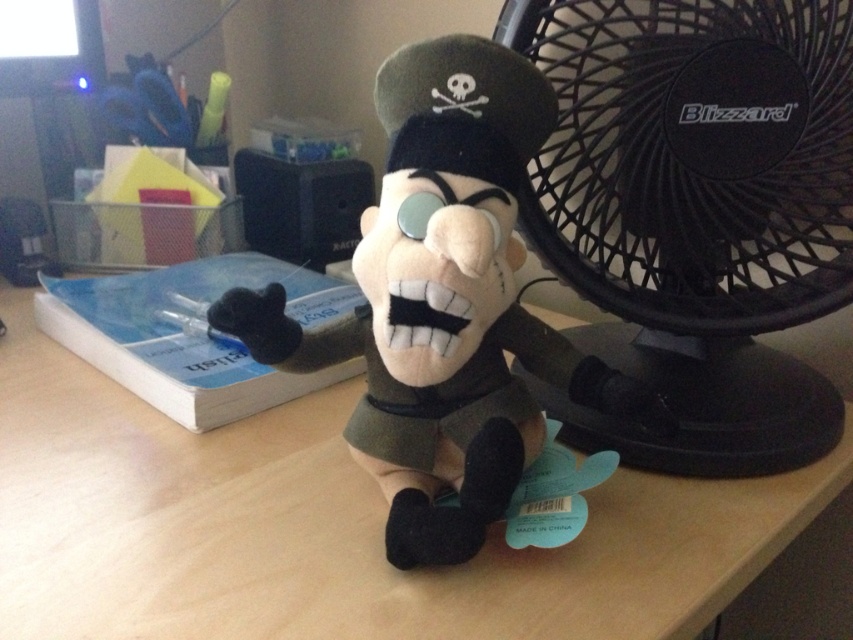
Is wooden table at center positioned behind black plastic fan at right?

That is False.

Can you confirm if wooden table at center is wider than black plastic fan at right?

Yes.

At what (x,y) coordinates should I click in order to perform the action: click on wooden table at center. Please return your answer as a coordinate pair (x, y). Image resolution: width=853 pixels, height=640 pixels. Looking at the image, I should click on (326, 529).

Is black plastic fan at right positioned before soft plush toy at center?

No, black plastic fan at right is behind soft plush toy at center.

Looking at this image, who is more forward, (572, 81) or (358, 260)?

Point (358, 260)

Does point (717, 346) come in front of point (506, 330)?

No, (717, 346) is further to viewer.

What are the coordinates of `black plastic fan at right` in the screenshot? It's located at (695, 212).

Is point (57, 632) farther from camera compared to point (506, 396)?

No, it is in front of (506, 396).

Does point (30, 417) lie in front of point (422, 125)?

That is False.

Which is behind, point (711, 620) or point (376, 301)?

Point (711, 620)

Locate an element on the screen. This screenshot has width=853, height=640. wooden table at center is located at coordinates (326, 529).